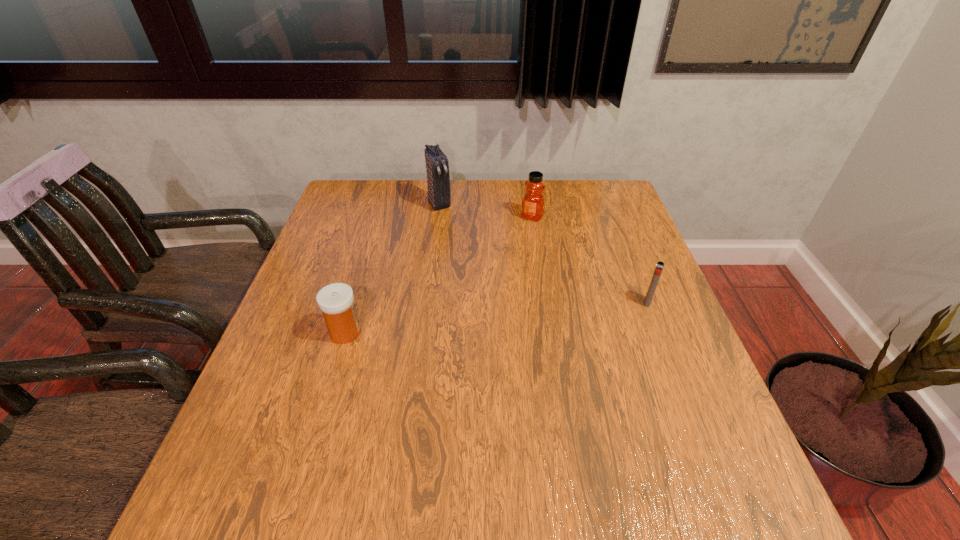
Find the location of `free point at the far edge`. free point at the far edge is located at coordinates (400, 211).

In the image, there is a desktop. Identify the location of vacant space at the near edge. (497, 457).

The width and height of the screenshot is (960, 540). In order to click on vacant space at the left edge of the desktop in this screenshot , I will do `click(336, 255)`.

You are a GUI agent. You are given a task and a screenshot of the screen. Output one action in this format:
    pyautogui.click(x=<x>, y=<y>)
    Task: Click on the vacant space at the right edge
    
    Given the screenshot: What is the action you would take?
    pyautogui.click(x=636, y=403)

The width and height of the screenshot is (960, 540). I want to click on blank space at the far left corner of the desktop, so click(x=348, y=217).

Identify the location of vacant space at the near left corner of the desktop. The height and width of the screenshot is (540, 960). (250, 418).

This screenshot has height=540, width=960. Find the location of `free region at the far right corner of the desktop`. free region at the far right corner of the desktop is located at coordinates (594, 199).

Identify the location of free area in between the rightmost object and the clutch bag. (543, 253).

The image size is (960, 540). In order to click on vacant area between the honey and the rightmost object in this screenshot , I will do `click(589, 260)`.

This screenshot has width=960, height=540. I want to click on vacant space in between the rightmost object and the third object from right to left, so click(543, 253).